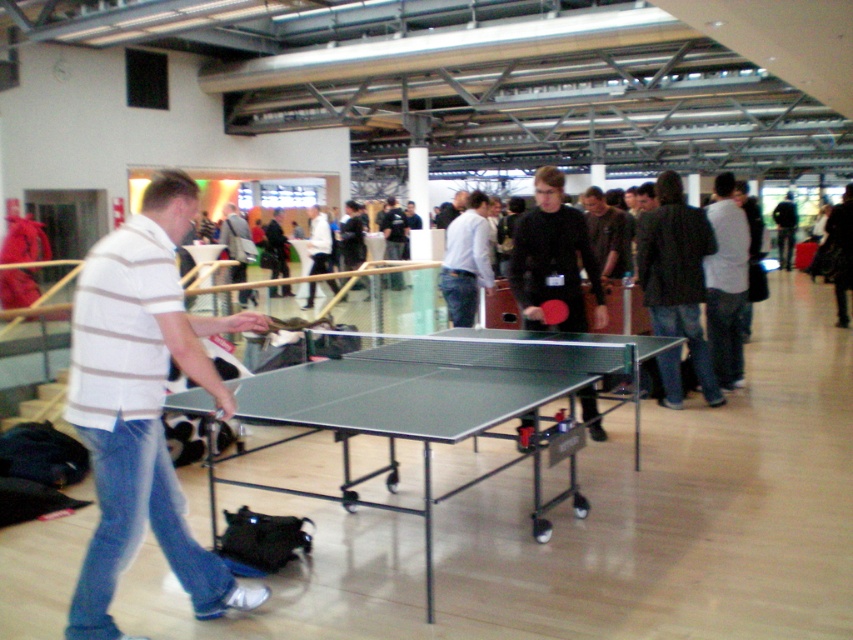
Question: Is white striped shirt at left above green rubber table tennis table at center?

Choices:
 (A) no
 (B) yes

Answer: (A)

Question: Can you confirm if white striped shirt at left is positioned above green rubber table at center?

Choices:
 (A) yes
 (B) no

Answer: (A)

Question: Which point appears closest to the camera in this image?

Choices:
 (A) (447, 353)
 (B) (576, 269)

Answer: (A)

Question: Which point is closer to the camera?

Choices:
 (A) (563, 316)
 (B) (508, 376)
 (C) (207, 564)

Answer: (C)

Question: Can you confirm if green rubber table at center is positioned to the left of matte black ping pong paddle at center?

Choices:
 (A) no
 (B) yes

Answer: (B)

Question: Which point is farther from the camera taking this photo?

Choices:
 (A) (115, 513)
 (B) (549, 300)
 (C) (212, 540)

Answer: (B)